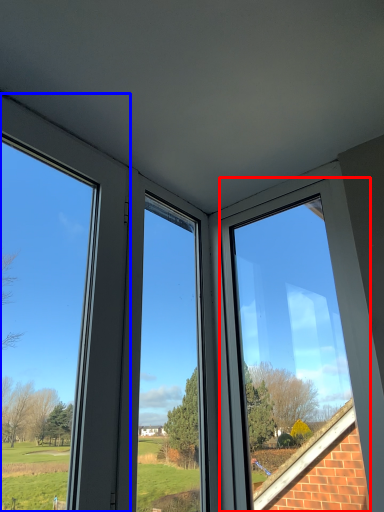
Question: Which object appears closest to the camera in this image, window (highlighted by a red box) or window (highlighted by a blue box)?

Choices:
 (A) window
 (B) window

Answer: (B)